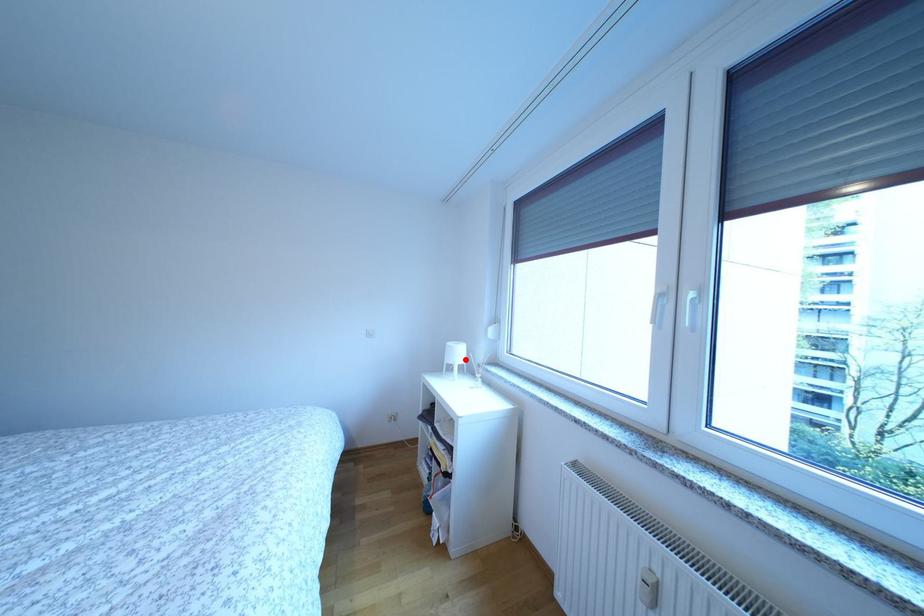
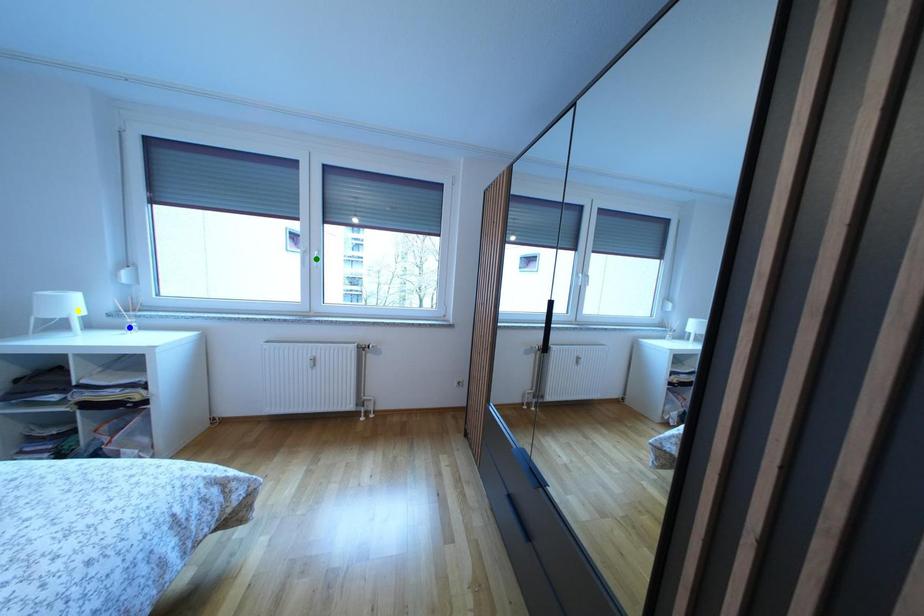
Question: I am providing you with two images of the same scene from different viewpoints. A red point is marked on the first image. You are given multiple points on the second image. Which mark in image 2 goes with the point in image 1?

Choices:
 (A) blue point
 (B) yellow point
 (C) green point

Answer: (B)